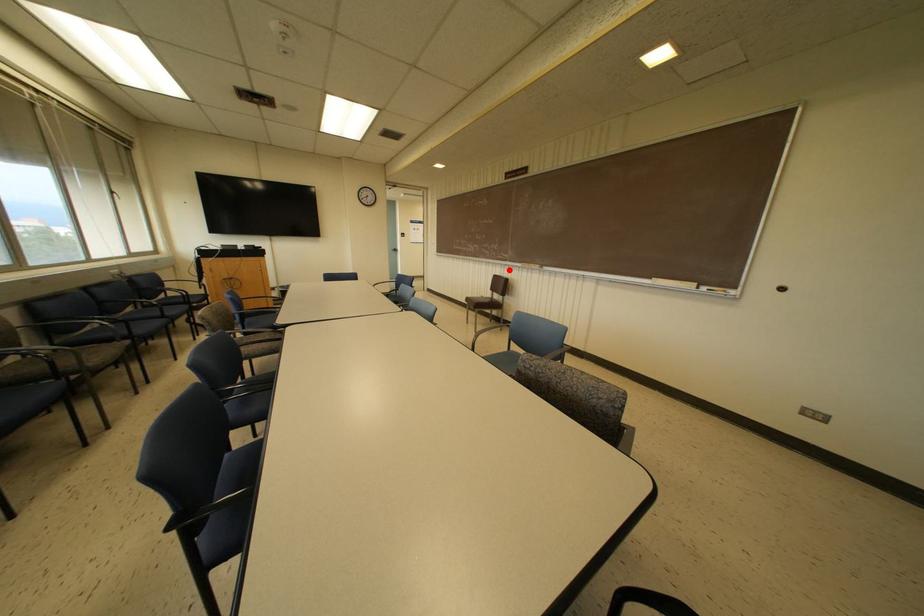
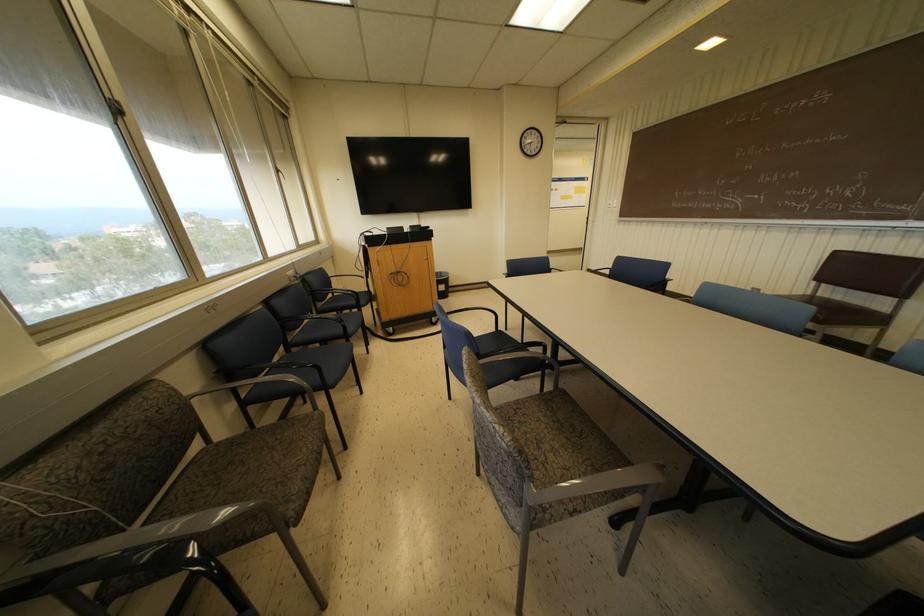
Question: A red point is marked in image1. In image2, is the corresponding 3D point closer to the camera or farther? Reply with the corresponding letter.

Choices:
 (A) The corresponding 3D point is closer.
 (B) The corresponding 3D point is farther.

Answer: (B)